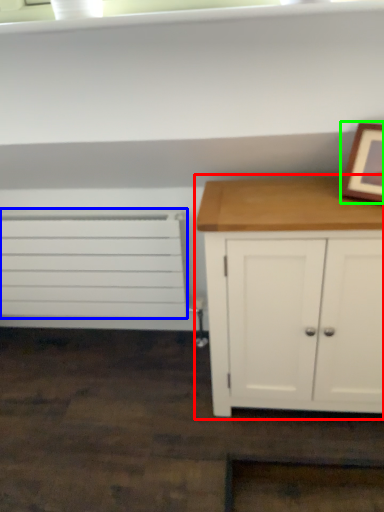
Question: Considering the real-world distances, which object is farthest from chest of drawers (highlighted by a red box)? drawer (highlighted by a blue box) or picture frame (highlighted by a green box)?

Choices:
 (A) drawer
 (B) picture frame

Answer: (A)